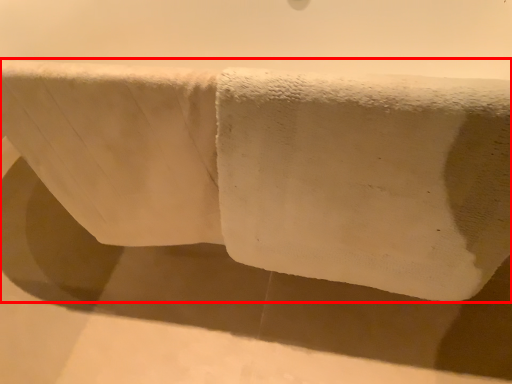
Question: From the image's perspective, considering the relative positions of towel (annotated by the red box) and bath towel in the image provided, where is towel (annotated by the red box) located with respect to the staircase?

Choices:
 (A) below
 (B) above

Answer: (B)